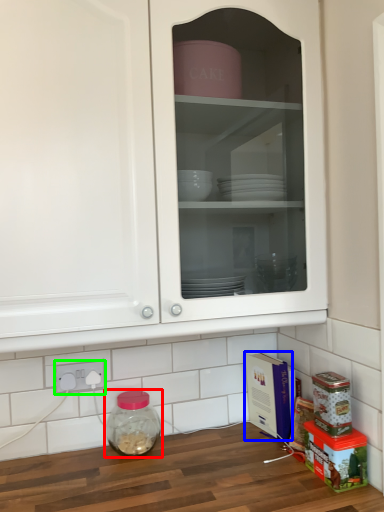
Question: Based on their relative distances, which object is nearer to glass jar (highlighted by a red box)? Choose from cardboard box (highlighted by a blue box) and electric outlet (highlighted by a green box).

Choices:
 (A) cardboard box
 (B) electric outlet

Answer: (B)